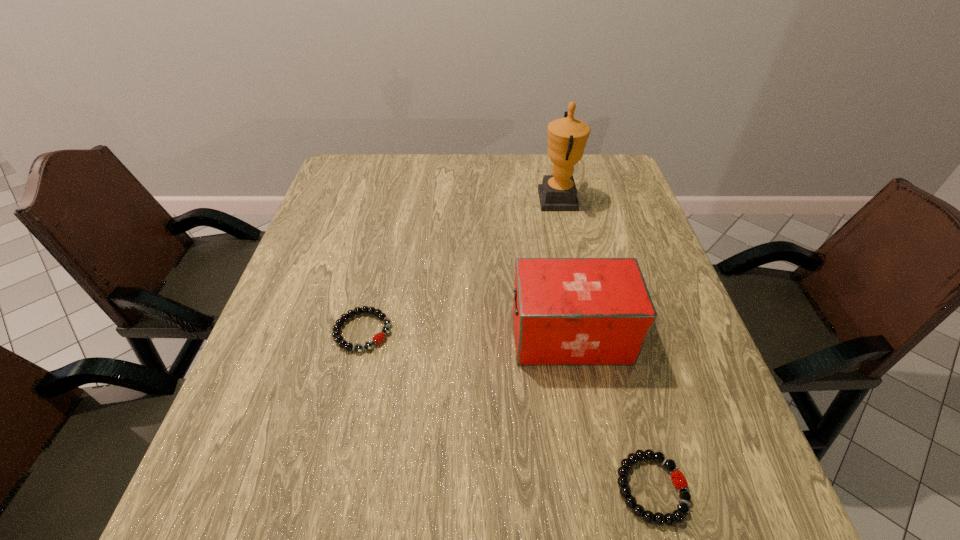
Locate an element on the screen. The height and width of the screenshot is (540, 960). vacant region between the award and the left bracelet is located at coordinates (461, 266).

Locate an element on the screen. free space between the nearer bracelet and the farther bracelet is located at coordinates (507, 410).

Where is `free space between the second tallest object and the left bracelet`? free space between the second tallest object and the left bracelet is located at coordinates (467, 334).

This screenshot has height=540, width=960. Identify the location of the closest object to the nearer bracelet. (567, 311).

At what (x,y) coordinates should I click in order to perform the action: click on object that is the nearest to the second tallest object. Please return your answer as a coordinate pair (x, y). The image size is (960, 540). Looking at the image, I should click on (678, 479).

You are a GUI agent. You are given a task and a screenshot of the screen. Output one action in this format:
    pyautogui.click(x=<x>, y=<y>)
    Task: Click on the vacant space that satisfies the following two spatial constraints: 1. on the handle side of the nearest object; 2. on the right side of the third shortest object
    The image size is (960, 540).
    Given the screenshot: What is the action you would take?
    pyautogui.click(x=598, y=488)

Identify the location of free location that satisfies the following two spatial constraints: 1. on the handle side of the second tallest object; 2. on the back side of the right bracelet. (598, 488).

Identify the location of free space that satisfies the following two spatial constraints: 1. at the front of the farthest object with handles; 2. on the right side of the right bracelet. (620, 488).

Where is `free space that satisfies the following two spatial constraints: 1. at the front of the nearer bracelet with handles; 2. on the right side of the farthest object`? free space that satisfies the following two spatial constraints: 1. at the front of the nearer bracelet with handles; 2. on the right side of the farthest object is located at coordinates (620, 488).

The height and width of the screenshot is (540, 960). In order to click on vacant region that satisfies the following two spatial constraints: 1. at the front of the award with handles; 2. on the right side of the right bracelet in this screenshot , I will do `click(620, 488)`.